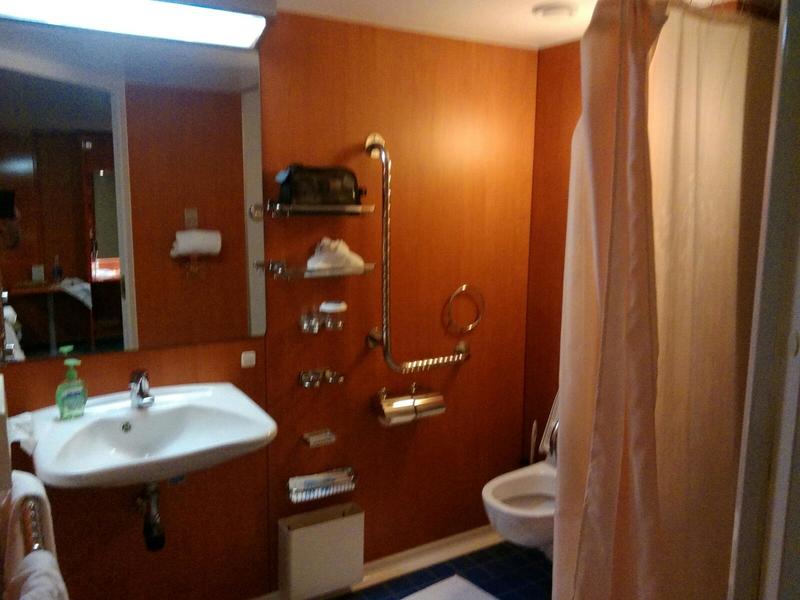
You are a GUI agent. You are given a task and a screenshot of the screen. Output one action in this format:
    pyautogui.click(x=<x>, y=<y>)
    Task: Click on the white facecloth
    The width and height of the screenshot is (800, 600).
    Given the screenshot: What is the action you would take?
    pyautogui.click(x=336, y=253)